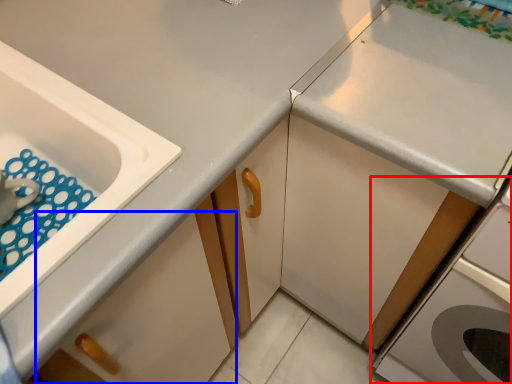
Question: Which of the following is the closest to the observer, home appliance (highlighted by a red box) or drawer (highlighted by a blue box)?

Choices:
 (A) home appliance
 (B) drawer

Answer: (B)